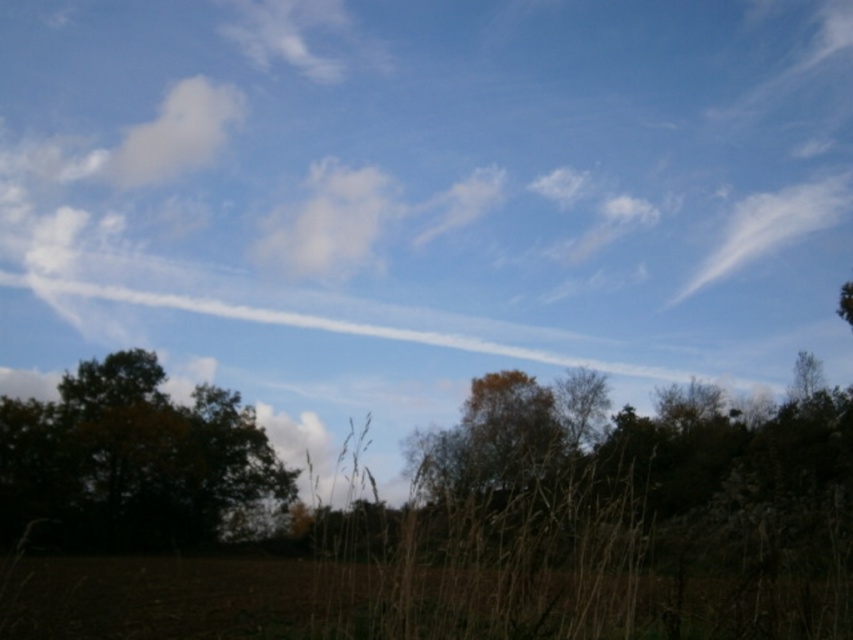
Question: Considering the real-world distances, which object is closest to the brown leafy tree at lower left?

Choices:
 (A) white fluffy cloud at upper left
 (B) white cotton cloud at upper right

Answer: (B)

Question: Is the position of white fluffy cloud at upper left more distant than that of white cotton cloud at upper right?

Choices:
 (A) yes
 (B) no

Answer: (A)

Question: Does brown leafy tree at lower left have a smaller size compared to white cotton cloud at upper right?

Choices:
 (A) no
 (B) yes

Answer: (B)

Question: Which of the following is the closest to the observer?

Choices:
 (A) white cotton cloud at upper right
 (B) white fluffy cloud at center
 (C) brown leafy tree at lower left

Answer: (C)

Question: Is white fluffy cloud at upper left above white cotton cloud at upper right?

Choices:
 (A) no
 (B) yes

Answer: (B)

Question: Which object is farther from the camera taking this photo?

Choices:
 (A) white cotton cloud at upper right
 (B) brown leafy tree at lower left

Answer: (A)